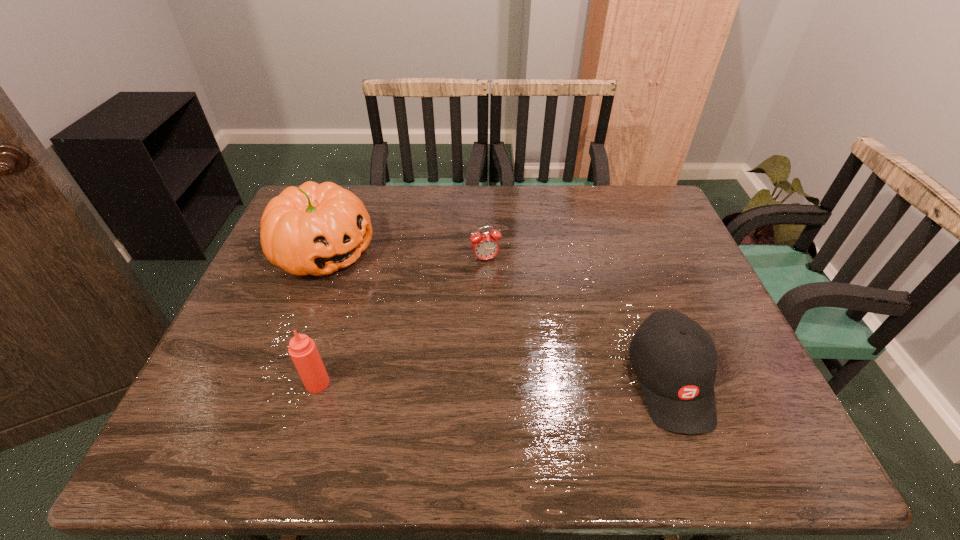
In the image, there is a desktop. At what (x,y) coordinates should I click in order to perform the action: click on free space at the left edge. Please return your answer as a coordinate pair (x, y). This screenshot has width=960, height=540. Looking at the image, I should click on (274, 313).

Locate an element on the screen. Image resolution: width=960 pixels, height=540 pixels. vacant region at the right edge of the desktop is located at coordinates (685, 246).

At what (x,y) coordinates should I click in order to perform the action: click on free spot at the near left corner of the desktop. Please return your answer as a coordinate pair (x, y). Looking at the image, I should click on (247, 381).

The image size is (960, 540). I want to click on unoccupied position between the pumpkin and the second object from right to left, so click(x=405, y=256).

Locate an element on the screen. The height and width of the screenshot is (540, 960). vacant area that lies between the pumpkin and the Tabasco sauce is located at coordinates (321, 318).

The image size is (960, 540). I want to click on unoccupied area between the third object from left to right and the pumpkin, so click(405, 256).

Identify the location of free area in between the second object from right to left and the Tabasco sauce. (401, 321).

Image resolution: width=960 pixels, height=540 pixels. I want to click on unoccupied area between the pumpkin and the second tallest object, so click(x=321, y=318).

Identify the location of free space that is in between the Tabasco sauce and the alarm clock. The width and height of the screenshot is (960, 540). (401, 321).

Identify the location of blank region between the Tabasco sauce and the baseball cap. This screenshot has height=540, width=960. (493, 382).